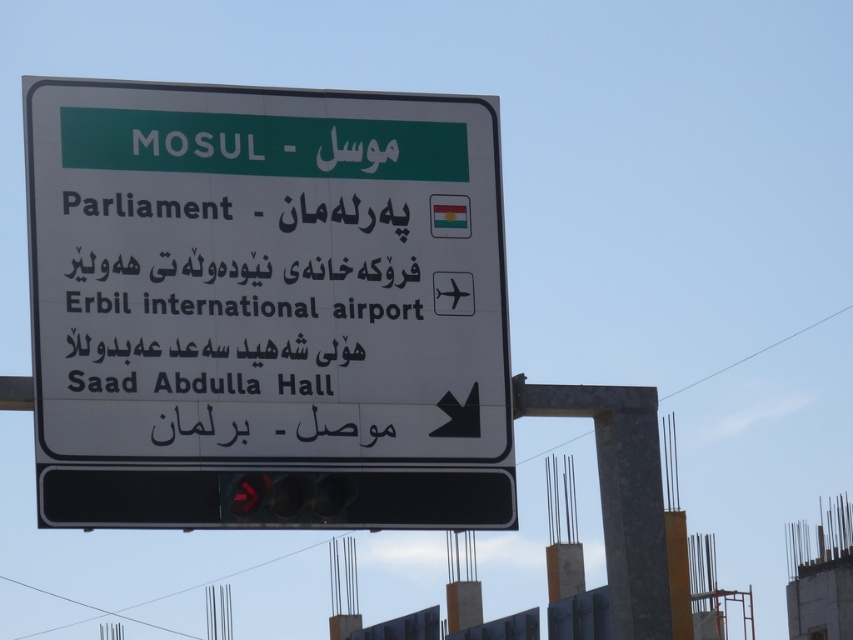
Question: Is white plastic sign at center wider than red glass traffic light at bottom center?

Choices:
 (A) no
 (B) yes

Answer: (B)

Question: Does black text at center come behind red glass traffic light at bottom center?

Choices:
 (A) no
 (B) yes

Answer: (A)

Question: Among these points, which one is farthest from the camera?

Choices:
 (A) (380, 490)
 (B) (245, 476)

Answer: (A)

Question: Can you confirm if black text at center is thinner than red glass traffic light at bottom center?

Choices:
 (A) yes
 (B) no

Answer: (B)

Question: Which object is the closest to the black text at center?

Choices:
 (A) red glass traffic light at bottom center
 (B) white plastic sign at center

Answer: (B)

Question: Which point is farther to the camera?

Choices:
 (A) (288, 477)
 (B) (70, 246)

Answer: (A)